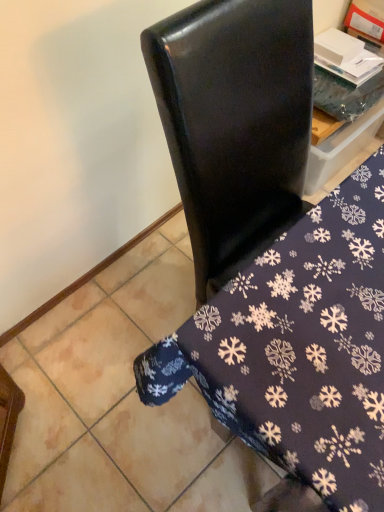
You are a GUI agent. You are given a task and a screenshot of the screen. Output one action in this format:
    pyautogui.click(x=<x>, y=<y>)
    Task: Click on the free space that is to the left of glossy black chair at center
    The height and width of the screenshot is (512, 384).
    Given the screenshot: What is the action you would take?
    pyautogui.click(x=133, y=344)